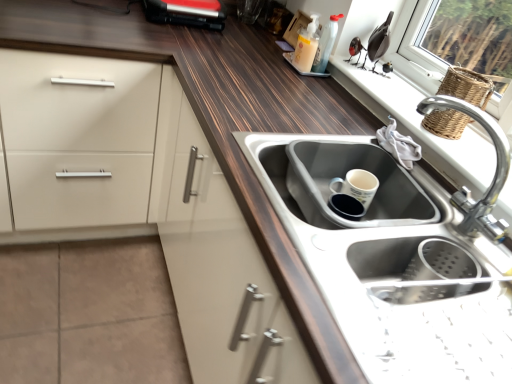
Question: In the image, is translucent plastic bottle at upper right, the 1th bottle from the right, positioned in front of or behind wooden window sill at upper right?

Choices:
 (A) front
 (B) behind

Answer: (B)

Question: Considering the positions of point (313, 72) and point (381, 112), is point (313, 72) closer or farther from the camera than point (381, 112)?

Choices:
 (A) closer
 (B) farther

Answer: (B)

Question: Considering the real-world distances, which object is closest to the stainless steel sink at lower right, the 2th sink viewed from the left?

Choices:
 (A) translucent plastic bottle at upper right, the second bottle positioned from the left
 (B) woven brown basket at upper right
 (C) satin steel sink at center, the second sink when ordered from right to left
 (D) silver metallic faucet at upper right
 (E) translucent plastic soap dispenser at upper center, which is the second bottle from right to left

Answer: (C)

Question: Based on their relative distances, which object is nearer to the silver metallic faucet at upper right?

Choices:
 (A) wooden window sill at upper right
 (B) stainless steel sink at lower right, the 2th sink viewed from the left
 (C) woven brown basket at upper right
 (D) translucent plastic bottle at upper right, the 1th bottle from the right
 (E) translucent plastic soap dispenser at upper center, which is the second bottle from right to left

Answer: (A)